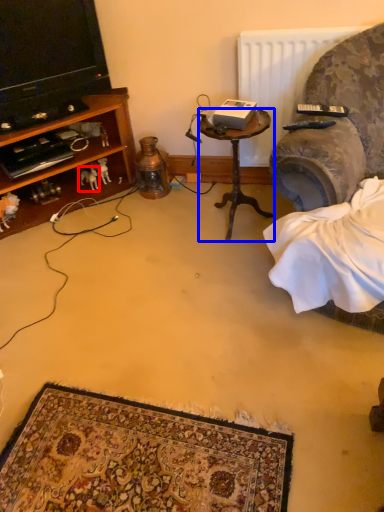
Question: Which object appears closest to the camera in this image, animal (highlighted by a red box) or desk (highlighted by a blue box)?

Choices:
 (A) animal
 (B) desk

Answer: (B)